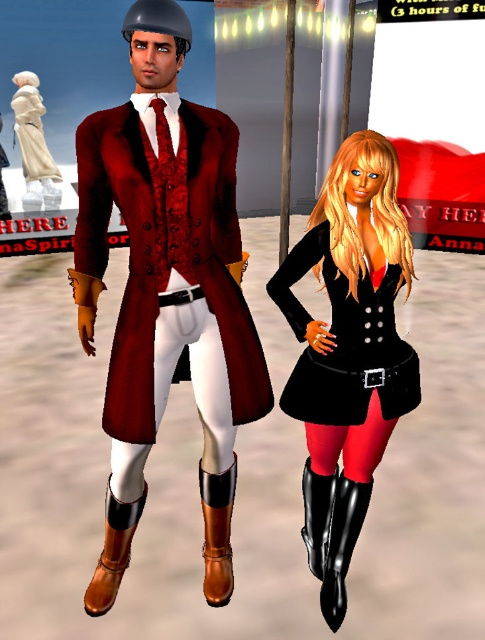
Question: Is white porcelain statue at left to the left of black leather boot at lower right from the viewer's perspective?

Choices:
 (A) no
 (B) yes

Answer: (B)

Question: Among these objects, which one is farthest from the camera?

Choices:
 (A) white porcelain statue at left
 (B) shiny leather coat at center
 (C) brown leather boot at lower left

Answer: (A)

Question: Which object is closer to the camera taking this photo?

Choices:
 (A) black satin dress at center
 (B) white porcelain statue at left

Answer: (A)

Question: Does white porcelain statue at left appear over brown leather boot at lower left?

Choices:
 (A) no
 (B) yes

Answer: (B)

Question: Which of the following is the closest to the observer?

Choices:
 (A) (36, 179)
 (B) (377, 344)
 (C) (207, 381)
 (D) (115, 545)

Answer: (C)

Question: In this image, where is white leather pants at center located relative to shiny brown leather boot at lower left?

Choices:
 (A) left
 (B) right

Answer: (A)